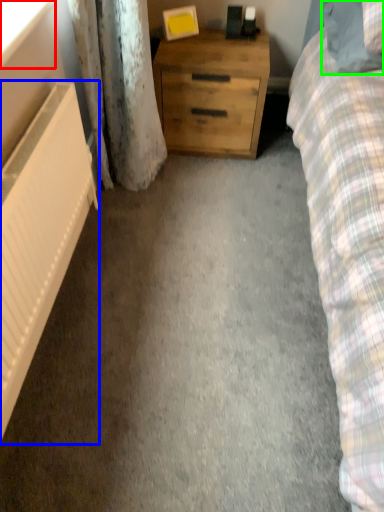
Question: Which object is positioned closest to window screen (highlighted by a red box)? Select from radiator (highlighted by a blue box) and pillow (highlighted by a green box).

Choices:
 (A) radiator
 (B) pillow

Answer: (A)